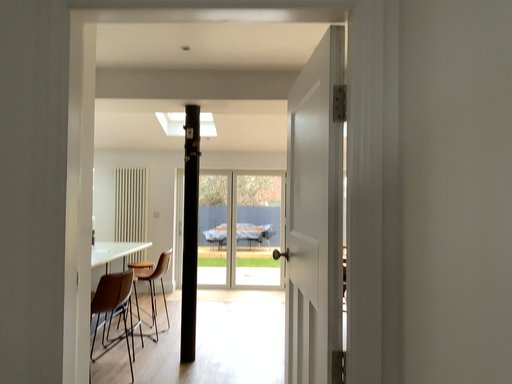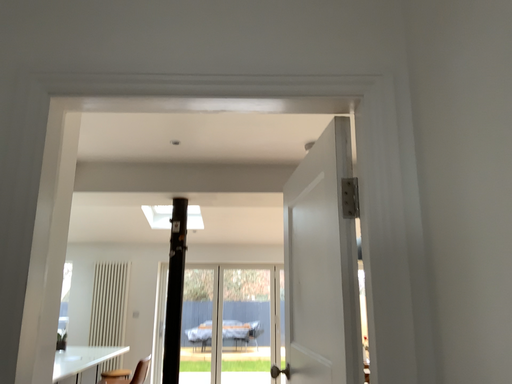
Question: How did the camera likely rotate when shooting the video?

Choices:
 (A) rotated upward
 (B) rotated downward

Answer: (A)